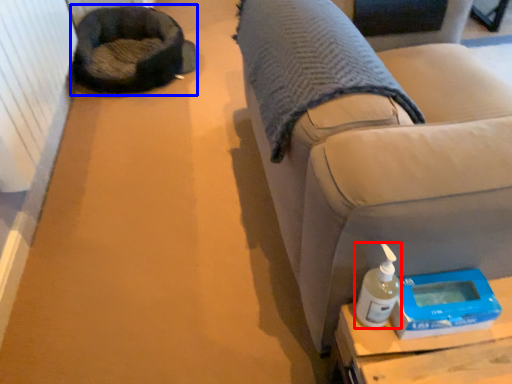
Question: Which object appears farthest to the camera in this image, bottle (highlighted by a red box) or bean bag chair (highlighted by a blue box)?

Choices:
 (A) bottle
 (B) bean bag chair

Answer: (B)